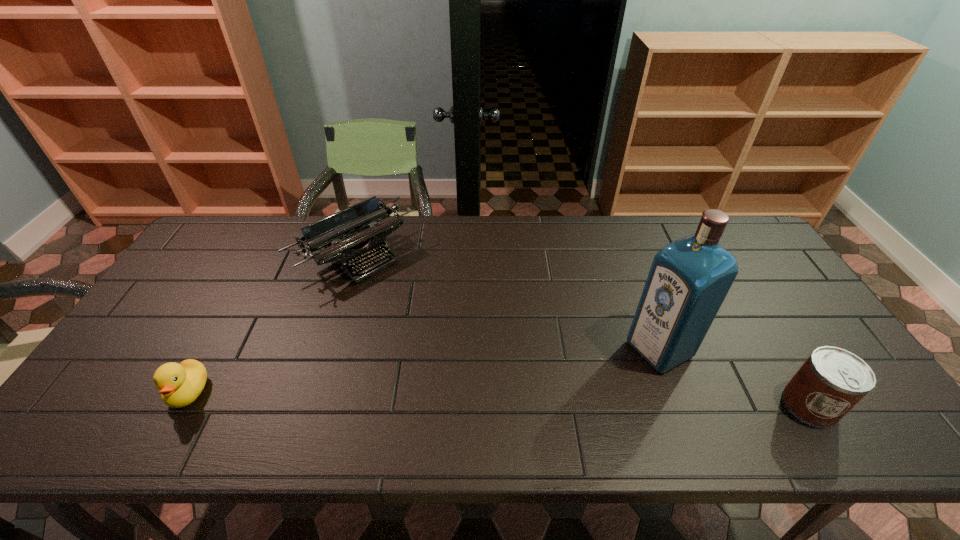
Identify the location of vacant space that satisfies the following two spatial constraints: 1. on the face of the leftmost object; 2. on the left side of the can. (181, 405).